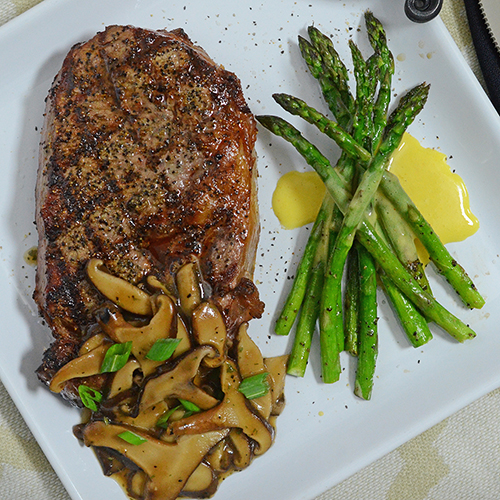
This screenshot has width=500, height=500. In order to click on square white plate in this screenshot , I will do `click(30, 35)`.